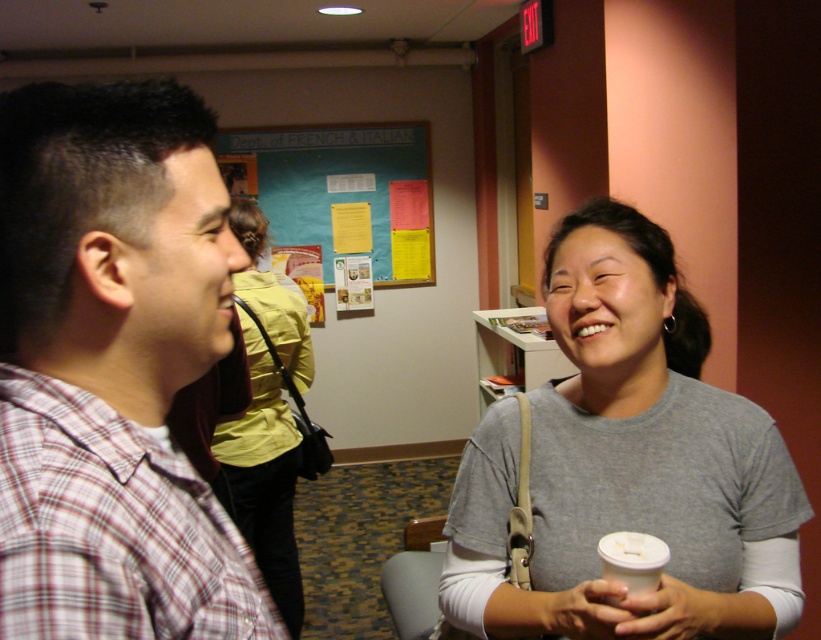
You are a photographer standing 10 feet away from the plaid shirt at left and gray cotton shirt at center. You want to take a group photo of both shirts. Given the camera you have can focus on subjects within 12 feet, will both shirts be in focus?

The distance between plaid shirt at left and gray cotton shirt at center is 20.88 inches. Since both shirts are within the 12 feet focus range of the camera, they will both be in focus.

Consider the image. You are a tailor measuring for a custom suit. You need to compare the width of the gray cotton shirt at center with the teal paperboard at upper center. Which one is wider?

The teal paperboard at upper center is wider than the gray cotton shirt at center because the gray cotton shirt at center has a smaller width.